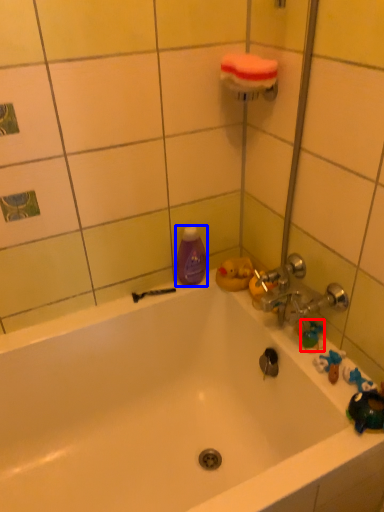
Question: Which point is closer to the camera, toy (highlighted by a red box) or cleaning product (highlighted by a blue box)?

Choices:
 (A) toy
 (B) cleaning product

Answer: (A)